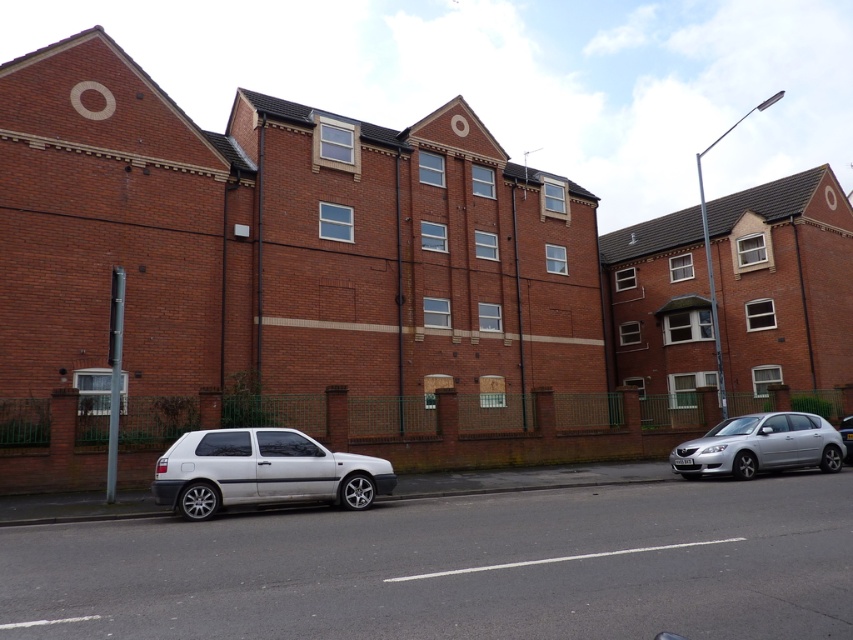
You are a delivery driver who needs to park your vehicle between the white matte hatchback at lower left and the silver metallic car at right. Given that your vehicle is 1.8 meters wide, can you fit your car in the available space between them?

The white matte hatchback at lower left might be wider than silver metallic car at right. If the hatchback is indeed wider, the space between them may be insufficient for your 1.8 meter wide vehicle. However, if the hatchback is narrower, there might be enough space. Without exact measurements, it is uncertain whether the space will accommodate your vehicle.

You are a delivery person trying to park a new vehicle between the silver metallic hatchback at right and the silver metallic car at right. The new vehicle is 1.5 meters tall. Can it fit vertically between them?

The silver metallic hatchback at right is taller than the silver metallic car at right. Since the hatchback is taller, the vertical space between them may vary depending on their positions. However, the height of the new vehicle is 1.5 meters. Without specific clearance information between the two vehicles, it is uncertain if it will fit. Consider checking the available space physically.